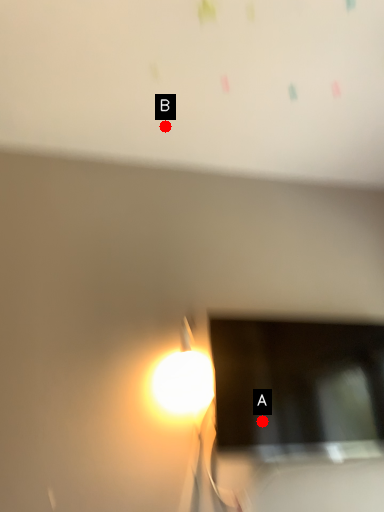
Question: Two points are circled on the image, labeled by A and B beside each circle. Which point is closer to the camera?

Choices:
 (A) A is closer
 (B) B is closer

Answer: (A)